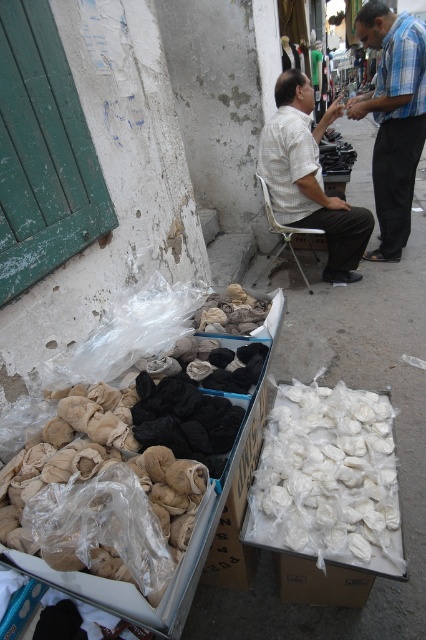
You are a customer looking at the shirts displayed on the ground. Which shirt is positioned higher up between the blue plaid shirt at upper right and the white textured shirt at center?

The blue plaid shirt at upper right is located above the white textured shirt at center.

You are a delivery person who needs to place a small package between the white textured shirt at center and the metallic silver chair at center. Is there enough space to fit the package, which is 12 inches long?

The distance between the white textured shirt at center and the metallic silver chair at center is 12.13 inches, so the 12 inch package can fit between them with a small amount of space to spare.

You are standing in the street scene and want to move from point A at point (386, 161) to point B at point (233, 330). Which direction should you move to get closer to point B?

To move closer to point B at point (233, 330) from point A at point (386, 161), you should move towards the lower right direction since point A is further away from the viewer compared to point B.